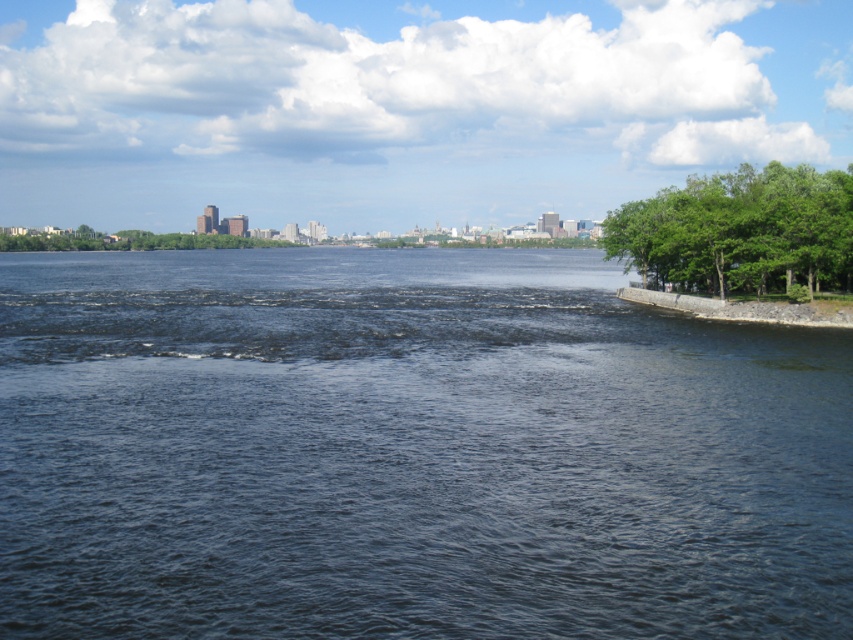
You are standing at the shoreline and see two points in the image. The first point is labeled as point (840, 308) and the second is point (148, 241). Which point is closer to you?

Point (840, 308) is in front of point (148, 241), so it is closer to you.

You are a kayaker planning to cross the river from the left bank to the right bank where the green leafy trees are. The distance between the dark blue water at center and the green leafy trees at right is 142.97 feet. Your kayak can travel 10 feet per second. How many seconds will it take you to reach the trees?

The distance between the dark blue water at center and the green leafy trees at right is 142.97 feet. At a speed of 10 feet per second, it will take approximately 14.3 seconds to reach the trees.

You are standing at the shoreline on the right side of the image. You want to cross the river to reach the opposite bank. The point marked as point (409, 451) indicates dark blue water at center. Is the dark blue water at center located in the direction you need to go to reach the opposite bank?

The point marked as point (409, 451) indicates dark blue water at center, which is located in the direction you need to go to reach the opposite bank. Since you are on the right shoreline, the center of the image would be towards the middle of the river, which is the path to the opposite bank.